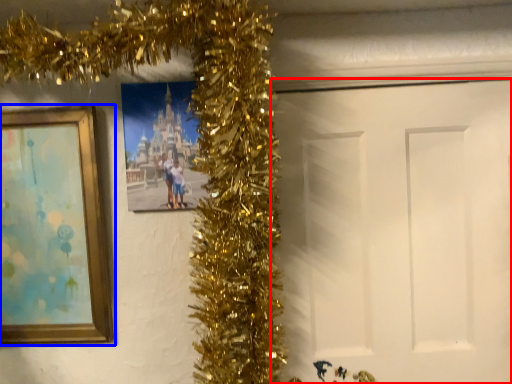
Question: Which point is closer to the camera, door (highlighted by a red box) or picture frame (highlighted by a blue box)?

Choices:
 (A) door
 (B) picture frame

Answer: (B)